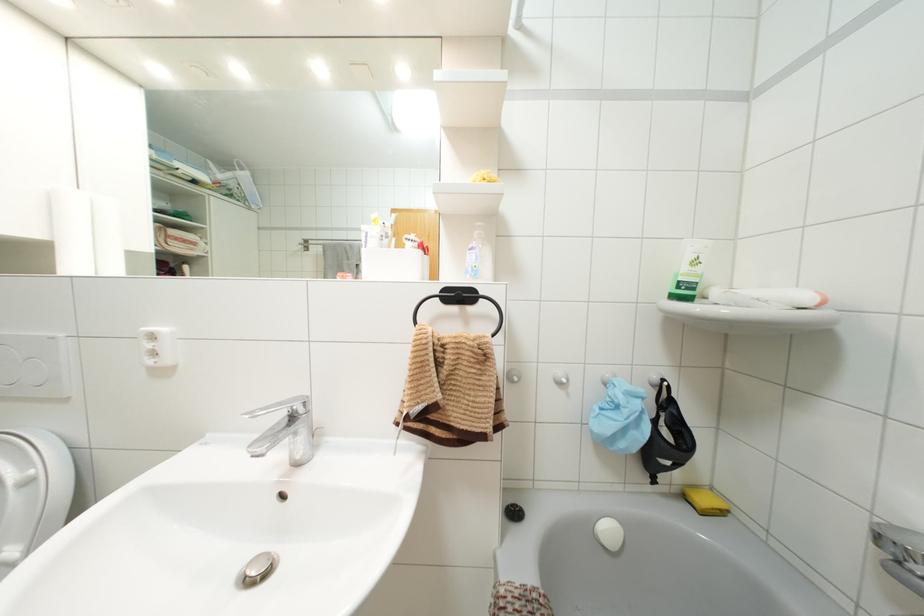
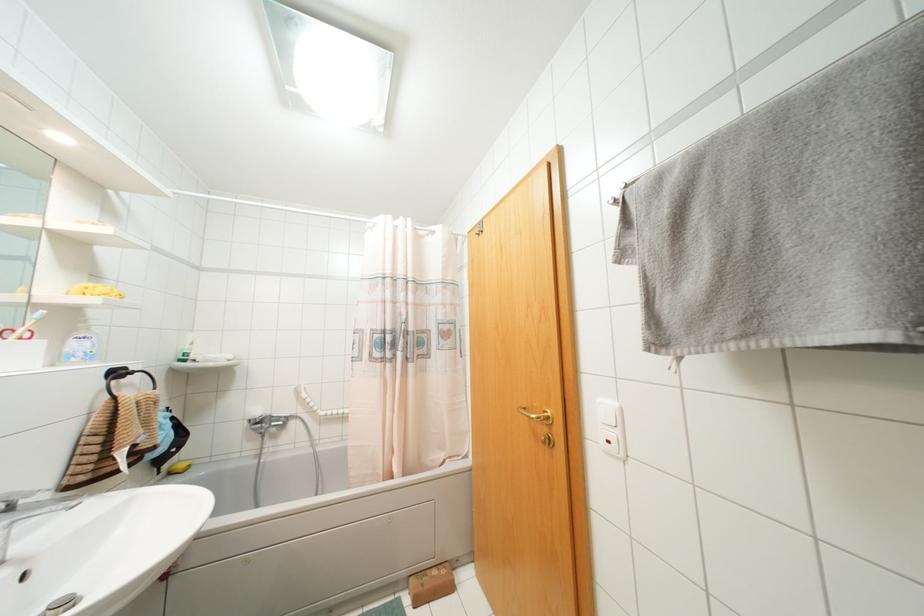
The point at (695, 262) is marked in the first image. Where is the corresponding point in the second image?

(190, 342)